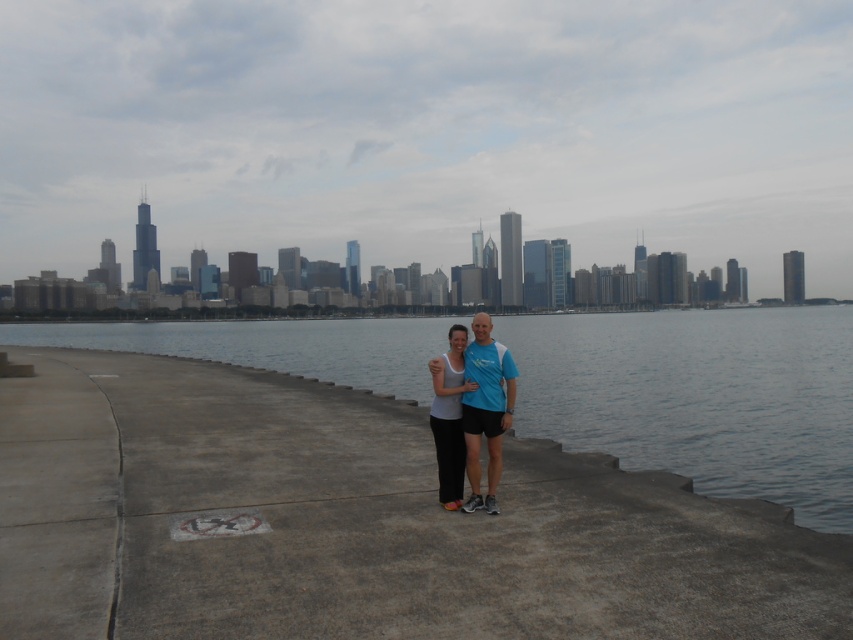
Question: Does clear water at center appear over blue fabric shirt at center?

Choices:
 (A) no
 (B) yes

Answer: (B)

Question: Is the position of clear water at center less distant than that of blue fabric shirt at center?

Choices:
 (A) no
 (B) yes

Answer: (A)

Question: Which of the following is the farthest from the observer?

Choices:
 (A) clear water at center
 (B) white matte tank top at center
 (C) blue fabric shirt at center

Answer: (A)

Question: Which of the following is the closest to the observer?

Choices:
 (A) (442, 484)
 (B) (738, 397)
 (C) (492, 502)

Answer: (C)

Question: Estimate the real-world distances between objects in this image. Which object is farther from the blue fabric shirt at center?

Choices:
 (A) clear water at center
 (B) white matte tank top at center

Answer: (A)

Question: Does clear water at center have a lesser width compared to white matte tank top at center?

Choices:
 (A) no
 (B) yes

Answer: (A)